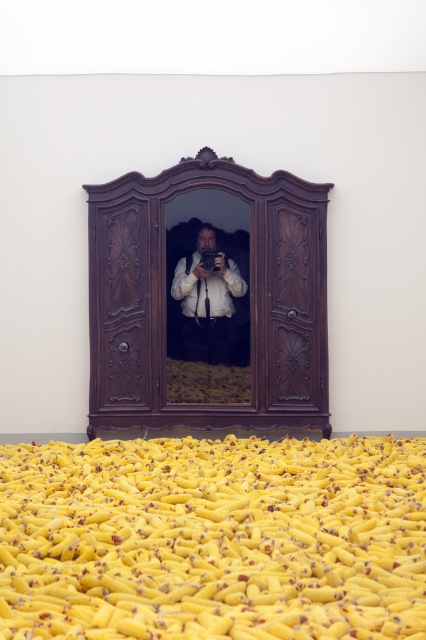
Question: Which of these objects is positioned closest to the polished dark wood armoire at center?

Choices:
 (A) white matte shirt at center
 (B) yellow matte banana at center

Answer: (A)

Question: Can you confirm if yellow matte banana at center is positioned below white matte shirt at center?

Choices:
 (A) yes
 (B) no

Answer: (A)

Question: Which of the following is the closest to the observer?

Choices:
 (A) polished dark wood armoire at center
 (B) white matte shirt at center
 (C) yellow matte banana at center

Answer: (C)

Question: Does yellow matte banana at center lie in front of polished dark wood armoire at center?

Choices:
 (A) no
 (B) yes

Answer: (B)

Question: Which point is closer to the camera taking this photo?

Choices:
 (A) click(149, 452)
 (B) click(221, 316)

Answer: (A)

Question: Is yellow matte banana at center to the left of polished dark wood armoire at center from the viewer's perspective?

Choices:
 (A) yes
 (B) no

Answer: (B)